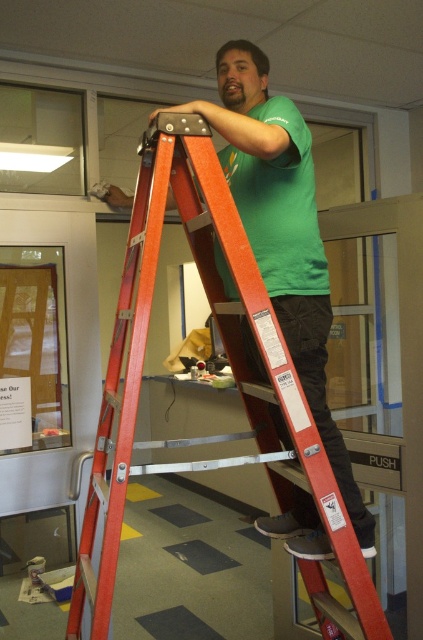
Is orange metallic ladder at center below wooden bulletin board at left?

Yes, orange metallic ladder at center is below wooden bulletin board at left.

In the scene shown: Is orange metallic ladder at center smaller than wooden bulletin board at left?

No.

Image resolution: width=423 pixels, height=640 pixels. What do you see at coordinates (231, 369) in the screenshot? I see `orange metallic ladder at center` at bounding box center [231, 369].

You are a GUI agent. You are given a task and a screenshot of the screen. Output one action in this format:
    pyautogui.click(x=<x>, y=<y>)
    Task: Click on the orange metallic ladder at center
    This screenshot has width=423, height=640.
    Given the screenshot: What is the action you would take?
    pyautogui.click(x=231, y=369)